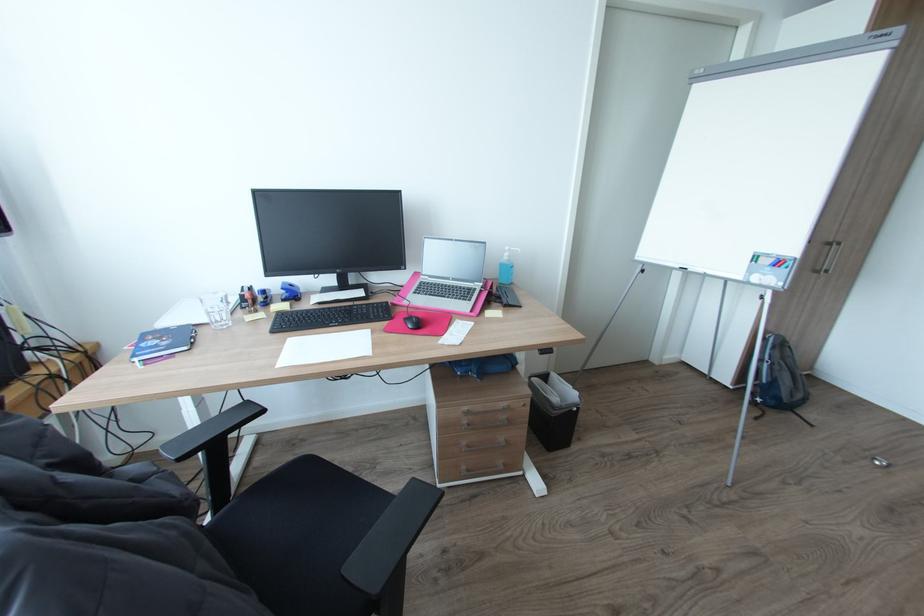
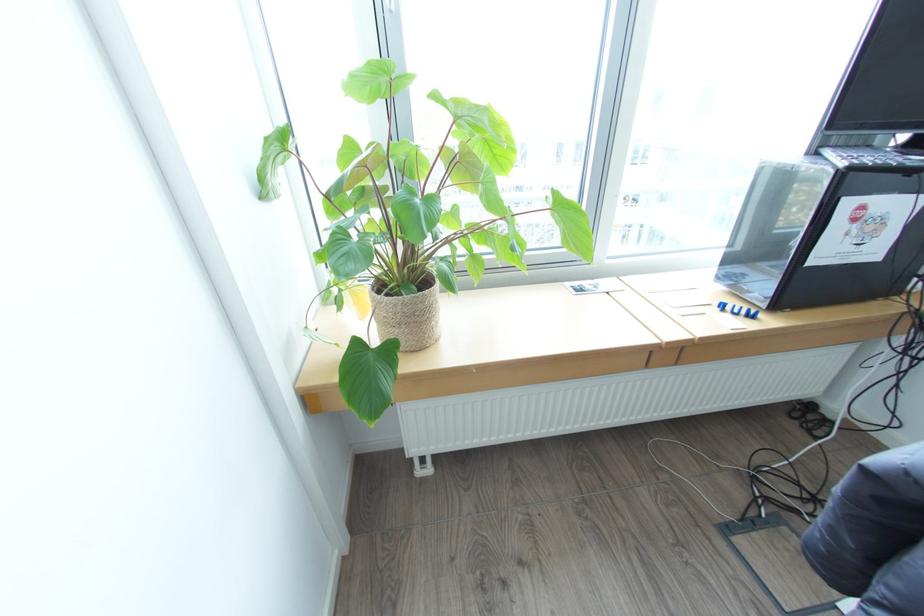
The images are taken continuously from a first-person perspective. In which direction is your viewpoint rotating?

The camera's rotation is toward left-down.